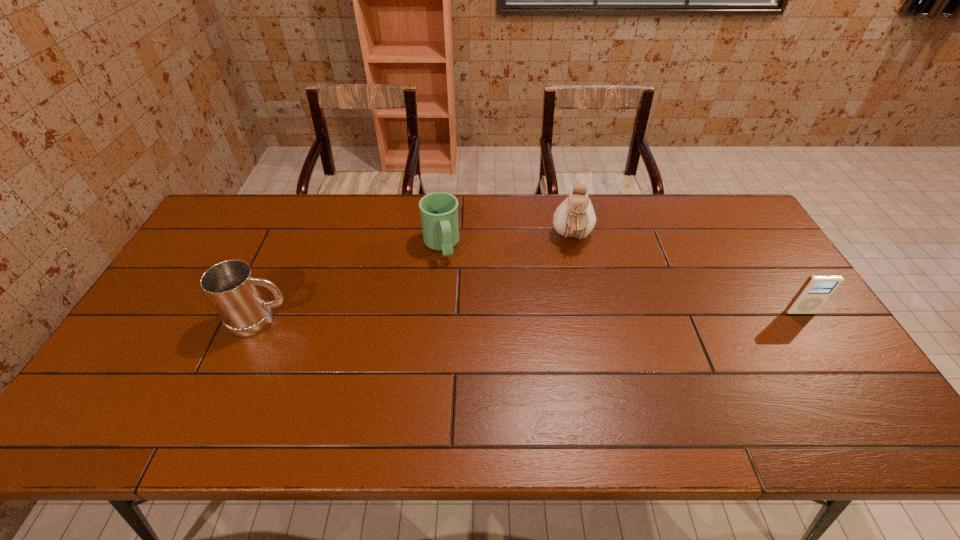
The width and height of the screenshot is (960, 540). Identify the location of the left mug. (234, 291).

This screenshot has height=540, width=960. Identify the location of the leftmost object. (234, 291).

You are a GUI agent. You are given a task and a screenshot of the screen. Output one action in this format:
    pyautogui.click(x=<x>, y=<y>)
    Task: Click on the iPod
    This screenshot has width=960, height=540.
    Given the screenshot: What is the action you would take?
    pyautogui.click(x=817, y=289)

At what (x,y) coordinates should I click in order to perform the action: click on the third object from left to right. Please return your answer as a coordinate pair (x, y). The height and width of the screenshot is (540, 960). Looking at the image, I should click on (574, 218).

The image size is (960, 540). What are the coordinates of `the second object from left to right` in the screenshot? It's located at (439, 210).

At what (x,y) coordinates should I click in order to perform the action: click on the farther mug. Please return your answer as a coordinate pair (x, y). Looking at the image, I should click on (439, 210).

Identify the location of free location located on the side of the nearer mug with the handle. The image size is (960, 540). coord(437,320).

Identify the location of free location located on the front-facing side of the rightmost object. The image size is (960, 540). (822, 345).

Image resolution: width=960 pixels, height=540 pixels. I want to click on free spot located 0.270m on the front-facing side of the pouch, so click(x=576, y=322).

This screenshot has width=960, height=540. Identify the location of vacant space located 0.400m on the front-facing side of the pouch. (578, 362).